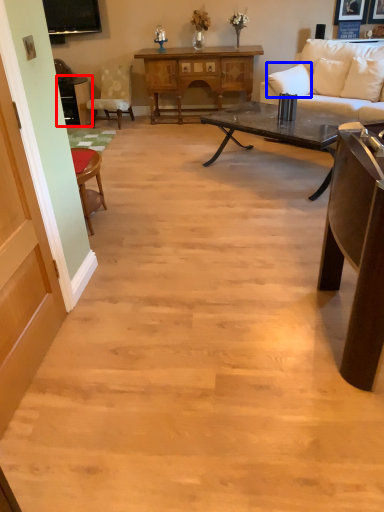
Question: Which object is closer to the camera taking this photo, table (highlighted by a red box) or pillow (highlighted by a blue box)?

Choices:
 (A) table
 (B) pillow

Answer: (B)